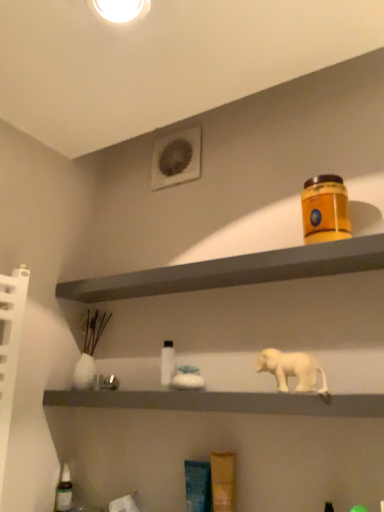
Question: From their relative heights in the image, would you say translucent glass bottle at lower left, placed as the 1th bottle when sorted from bottom to top, is taller or shorter than white plastic air conditioning unit at upper center?

Choices:
 (A) short
 (B) tall

Answer: (A)

Question: In the image, is translucent glass bottle at lower left, which appears as the second bottle when viewed from the top, positioned in front of or behind white plastic air conditioning unit at upper center?

Choices:
 (A) front
 (B) behind

Answer: (A)

Question: Based on their relative distances, which object is farther from the white matte elephant at center?

Choices:
 (A) white plastic air conditioning unit at upper center
 (B) orange matte jar at upper right
 (C) matte orange container at upper right, the second shelf from the bottom
 (D) translucent glass bottle at lower left, which is counted as the 1th bottle, starting from the left
 (E) white glossy bottle at center, marked as the 2th bottle in a left-to-right arrangement

Answer: (D)

Question: Based on their relative distances, which object is farther from the matte orange container at upper right, which ranks as the first shelf in top-to-bottom order?

Choices:
 (A) translucent glass bottle at lower left, which appears as the second bottle when viewed from the top
 (B) white glossy bottle at center, the first bottle in the top-to-bottom sequence
 (C) white plastic air conditioning unit at upper center
 (D) white matte elephant at center
 (E) white matte elephant at center, the 2th shelf in the top-to-bottom sequence

Answer: (A)